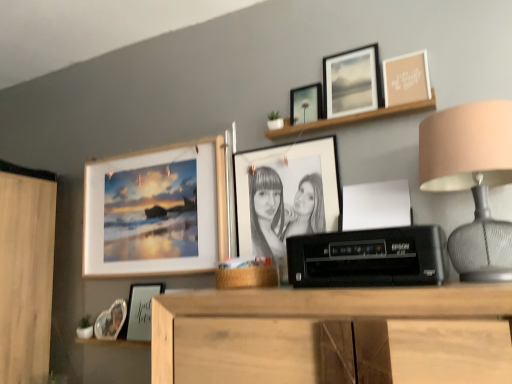
Question: Does matte black photo frame at center, which is counted as the fourth picture frame, starting from the right, appear on the right side of clear glass photo frame at lower left, the first picture frame in the left-to-right sequence?

Choices:
 (A) no
 (B) yes

Answer: (B)

Question: From the image's perspective, is matte black photo frame at center, positioned as the fourth picture frame in left-to-right order, beneath clear glass photo frame at lower left, marked as the 7th picture frame in a right-to-left arrangement?

Choices:
 (A) yes
 (B) no

Answer: (B)

Question: From a real-world perspective, is matte black photo frame at center, which is counted as the fourth picture frame, starting from the right, located higher than clear glass photo frame at lower left, marked as the 7th picture frame in a right-to-left arrangement?

Choices:
 (A) yes
 (B) no

Answer: (A)

Question: From a real-world perspective, is matte black photo frame at center, which is counted as the fourth picture frame, starting from the right, under clear glass photo frame at lower left, the first picture frame in the left-to-right sequence?

Choices:
 (A) yes
 (B) no

Answer: (B)

Question: Is matte black photo frame at center, which is counted as the fourth picture frame, starting from the right, positioned behind clear glass photo frame at lower left, the first picture frame in the left-to-right sequence?

Choices:
 (A) yes
 (B) no

Answer: (B)

Question: Would you say matte black picture frame at upper center, which is counted as the sixth picture frame, starting from the left, is to the left or to the right of matte black photo frame at center, which is counted as the fourth picture frame, starting from the right, in the picture?

Choices:
 (A) right
 (B) left

Answer: (A)

Question: Relative to matte black photo frame at center, which is counted as the fourth picture frame, starting from the right, is matte black picture frame at upper center, the 2th picture frame in the right-to-left sequence, in front or behind?

Choices:
 (A) behind
 (B) front

Answer: (A)

Question: Is matte black picture frame at upper center, the 2th picture frame in the right-to-left sequence, taller or shorter than matte black photo frame at center, positioned as the fourth picture frame in left-to-right order?

Choices:
 (A) short
 (B) tall

Answer: (A)

Question: From the image's perspective, is matte black picture frame at upper center, which is counted as the sixth picture frame, starting from the left, located above or below matte black photo frame at center, which is counted as the fourth picture frame, starting from the right?

Choices:
 (A) above
 (B) below

Answer: (A)

Question: Based on their positions, is white matte frame at lower center, which is the first shelf from left to right, located to the left or right of matte black picture frame at lower left, which is counted as the 5th picture frame, starting from the right?

Choices:
 (A) right
 (B) left

Answer: (B)

Question: From the image's perspective, is white matte frame at lower center, acting as the 2th shelf starting from the right, located above or below matte black picture frame at lower left, the 3th picture frame in the left-to-right sequence?

Choices:
 (A) below
 (B) above

Answer: (A)

Question: Does point coord(99,344) appear closer or farther from the camera than point coord(148,312)?

Choices:
 (A) farther
 (B) closer

Answer: (A)

Question: Looking at the image, does white matte frame at lower center, which is the first shelf in bottom-to-top order, seem bigger or smaller compared to matte black picture frame at lower left, which is counted as the 5th picture frame, starting from the right?

Choices:
 (A) big
 (B) small

Answer: (B)

Question: Looking at the image, does wooden frame at upper center, arranged as the second shelf when viewed from the left, seem bigger or smaller compared to black plastic printer at center?

Choices:
 (A) small
 (B) big

Answer: (A)

Question: From a real-world perspective, is wooden frame at upper center, placed as the second shelf when sorted from bottom to top, physically located above or below black plastic printer at center?

Choices:
 (A) above
 (B) below

Answer: (A)